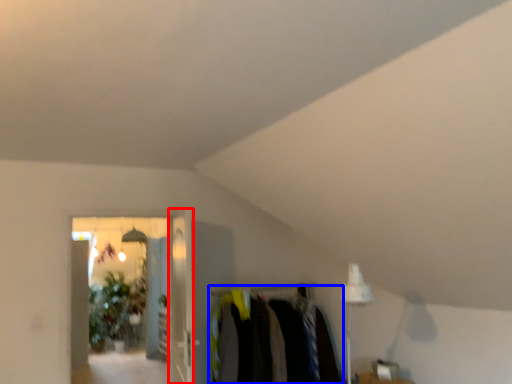
Question: Which object appears closest to the camera in this image, glass door (highlighted by a red box) or closet (highlighted by a blue box)?

Choices:
 (A) glass door
 (B) closet

Answer: (A)